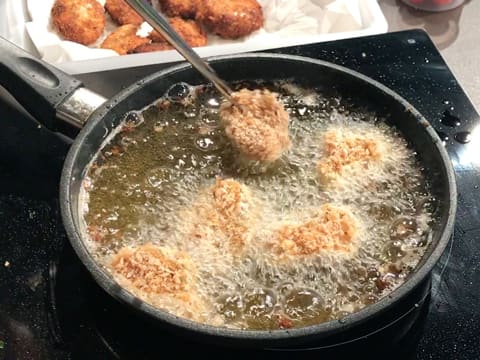
I want to click on stovetop, so (x=14, y=210).